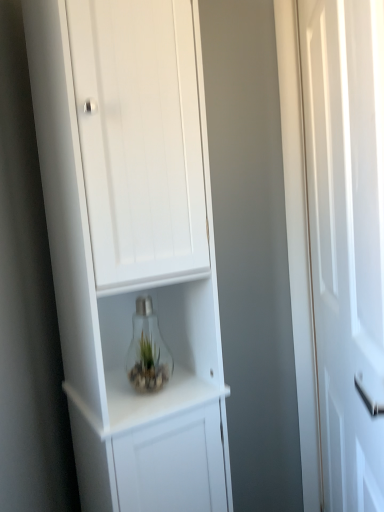
Question: Is white matte cabinet at center bigger than clear glass bulb at center?

Choices:
 (A) no
 (B) yes

Answer: (B)

Question: Is white matte cabinet at center not near clear glass bulb at center?

Choices:
 (A) yes
 (B) no

Answer: (B)

Question: From the image's perspective, is white matte cabinet at center over clear glass bulb at center?

Choices:
 (A) yes
 (B) no

Answer: (A)

Question: Is white matte cabinet at center oriented towards clear glass bulb at center?

Choices:
 (A) no
 (B) yes

Answer: (B)

Question: Is white matte cabinet at center not within clear glass bulb at center?

Choices:
 (A) yes
 (B) no

Answer: (A)

Question: Are white matte cabinet at center and clear glass bulb at center making contact?

Choices:
 (A) yes
 (B) no

Answer: (B)

Question: Are white glossy door at right and white matte cabinet at center located far from each other?

Choices:
 (A) yes
 (B) no

Answer: (B)

Question: Is white glossy door at right to the left of white matte cabinet at center from the viewer's perspective?

Choices:
 (A) no
 (B) yes

Answer: (A)

Question: Considering the relative sizes of white glossy door at right and white matte cabinet at center in the image provided, is white glossy door at right thinner than white matte cabinet at center?

Choices:
 (A) no
 (B) yes

Answer: (B)

Question: Is white glossy door at right shorter than white matte cabinet at center?

Choices:
 (A) no
 (B) yes

Answer: (B)

Question: From a real-world perspective, is white glossy door at right physically above white matte cabinet at center?

Choices:
 (A) no
 (B) yes

Answer: (A)

Question: Is white glossy door at right smaller than white matte cabinet at center?

Choices:
 (A) yes
 (B) no

Answer: (A)

Question: Can you confirm if clear glass bulb at center is bigger than white glossy door at right?

Choices:
 (A) yes
 (B) no

Answer: (B)